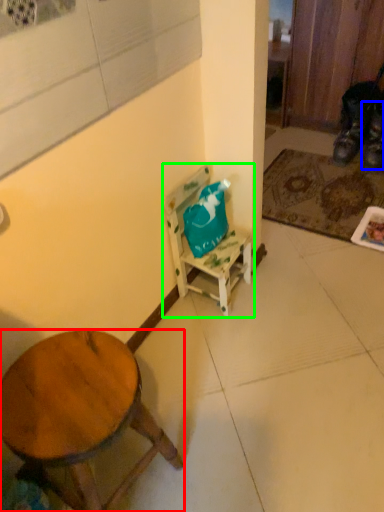
Question: Which object is positioned farthest from desk (highlighted by a red box)? Select from shoe (highlighted by a blue box) and chair (highlighted by a green box).

Choices:
 (A) shoe
 (B) chair

Answer: (A)